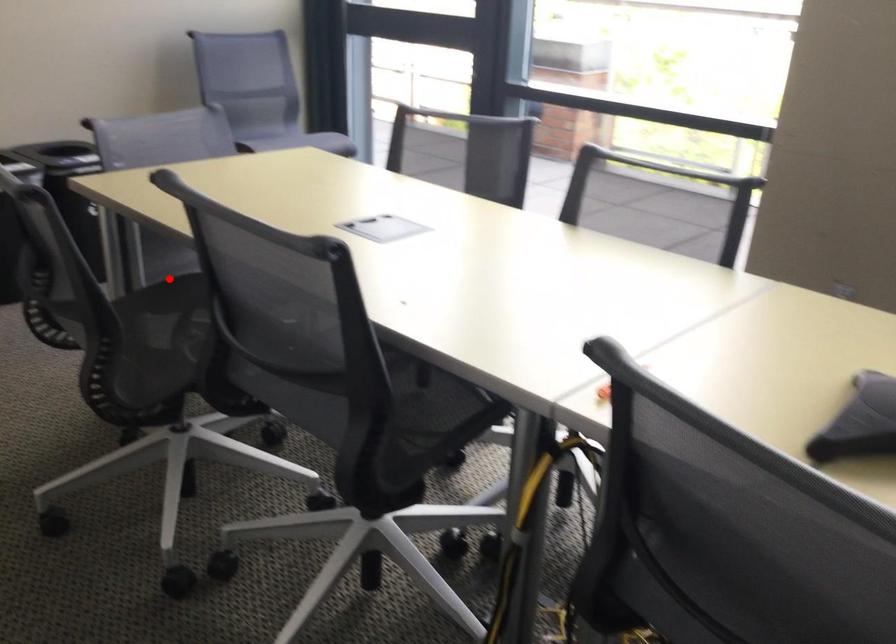
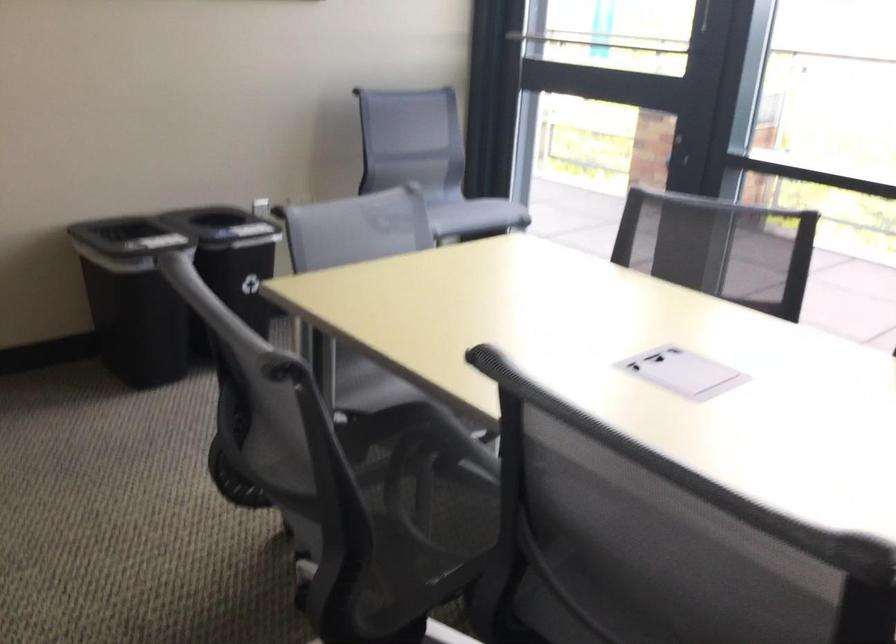
Find the pixel in the second image that matches the highlighted location in the first image.

(350, 399)